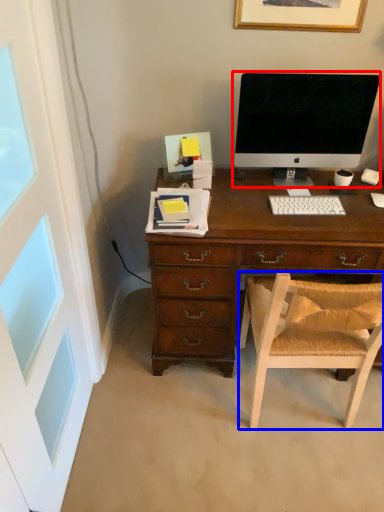
Question: Which object appears farthest to the camera in this image, computer monitor (highlighted by a red box) or chair (highlighted by a blue box)?

Choices:
 (A) computer monitor
 (B) chair

Answer: (A)